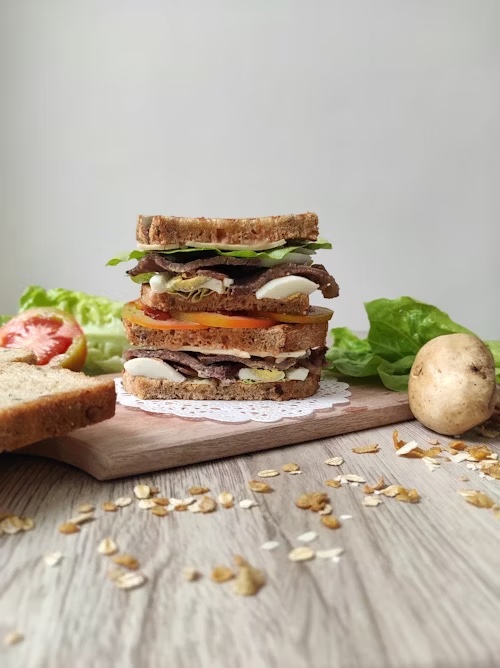
At what (x,y) coordinates should I click in order to perform the action: click on table. Please return your answer as a coordinate pair (x, y). Looking at the image, I should click on (437, 612).